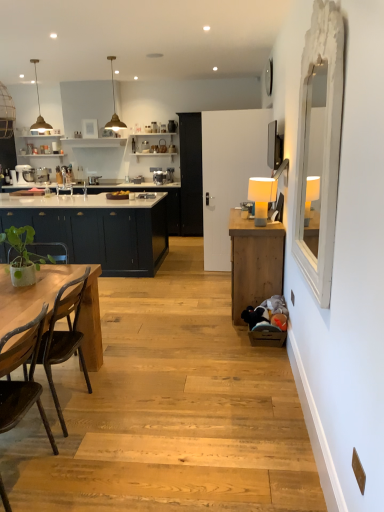
Question: From the image's perspective, is matte dark blue cabinets at left, the 2th cabinetry when ordered from front to back, below matte white sink at center?

Choices:
 (A) no
 (B) yes

Answer: (B)

Question: Does matte dark blue cabinets at left, the first cabinetry viewed from the left, have a greater height compared to matte white sink at center?

Choices:
 (A) yes
 (B) no

Answer: (A)

Question: Is matte dark blue cabinets at left, the 2th cabinetry positioned from the right, completely or partially outside of matte white sink at center?

Choices:
 (A) yes
 (B) no

Answer: (A)

Question: From the image's perspective, is matte dark blue cabinets at left, the first cabinetry viewed from the left, over matte white sink at center?

Choices:
 (A) no
 (B) yes

Answer: (A)

Question: Are matte dark blue cabinets at left, the first cabinetry from the back, and matte white sink at center making contact?

Choices:
 (A) yes
 (B) no

Answer: (B)

Question: Is matte dark blue cabinets at left, the first cabinetry from the back, thinner than matte white sink at center?

Choices:
 (A) no
 (B) yes

Answer: (A)

Question: Is natural wood table at left behind green matte plant at left?

Choices:
 (A) yes
 (B) no

Answer: (B)

Question: Is natural wood table at left taller than green matte plant at left?

Choices:
 (A) no
 (B) yes

Answer: (B)

Question: Can you confirm if natural wood table at left is thinner than green matte plant at left?

Choices:
 (A) yes
 (B) no

Answer: (B)

Question: Can you confirm if natural wood table at left is positioned to the left of green matte plant at left?

Choices:
 (A) yes
 (B) no

Answer: (B)

Question: Considering the relative positions of natural wood table at left and green matte plant at left in the image provided, is natural wood table at left to the right of green matte plant at left from the viewer's perspective?

Choices:
 (A) no
 (B) yes

Answer: (B)

Question: Does natural wood table at left have a greater width compared to green matte plant at left?

Choices:
 (A) yes
 (B) no

Answer: (A)

Question: Is gold metallic pendant light at upper center, the second lamp from the left, facing away from white wooden mirror at right?

Choices:
 (A) no
 (B) yes

Answer: (A)